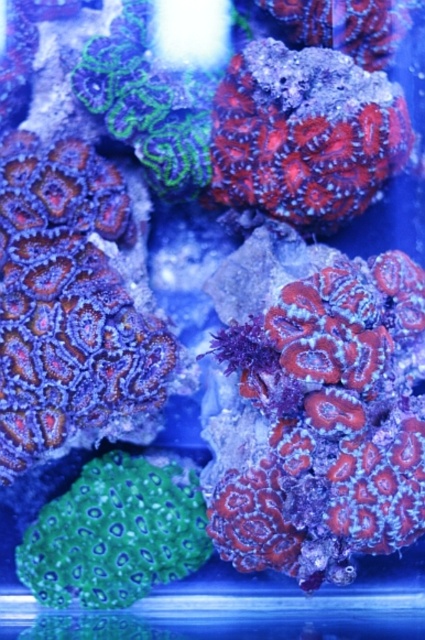
You are an underwater photographer aiming to capture the smooth coral at center and the shiny coral at center in a single frame. Given their positions and sizes, can you fit both corals into your camera viewfinder without moving the camera?

The smooth coral at center is wider than the shiny coral at center. Since the smooth coral at center is wider, it might occupy more space in the frame, but as long as the camera is positioned to include both, they can be captured together. However, the exact fit depends on the camera viewfinder size and their actual distances from the camera.

You are a marine biologist observing the aquarium. You notice the shiny coral at center and the green textured coral at lower left. Which coral is taller?

The shiny coral at center is much taller than the green textured coral at lower left.